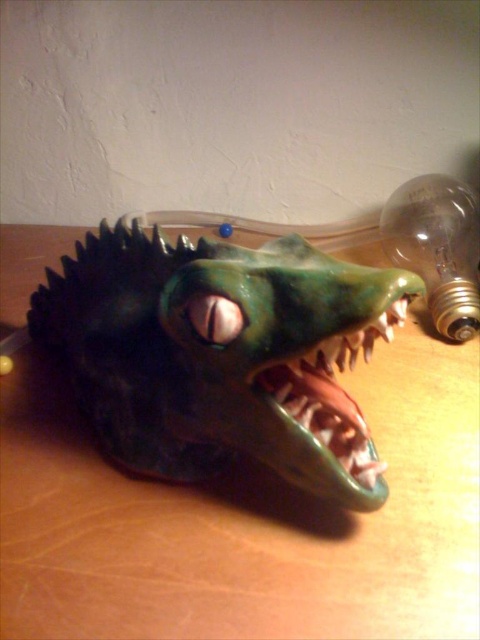
You are a delivery person who needs to place a package between the translucent glass bulb at upper right and the shiny metallic teeth at center. The package is 24 inches long. Will it fit in the space between them?

The distance between the translucent glass bulb at upper right and the shiny metallic teeth at center is 24.79 inches, so the 24 inch package will fit in the space between them.

Based on the photo, you are an artist trying to sketch the scene. You need to place the translucent glass bulb at upper right in your drawing. Where should you position it relative to the mask?

The translucent glass bulb at upper right should be placed at the coordinates 0.389 on the x axis and 0.912 on the y axis relative to the mask.